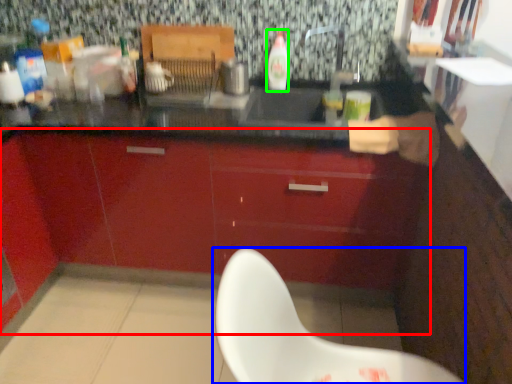
Question: Based on their relative distances, which object is nearer to cabinetry (highlighted by a red box)? Choose from chair (highlighted by a blue box) and bottle (highlighted by a green box).

Choices:
 (A) chair
 (B) bottle

Answer: (B)